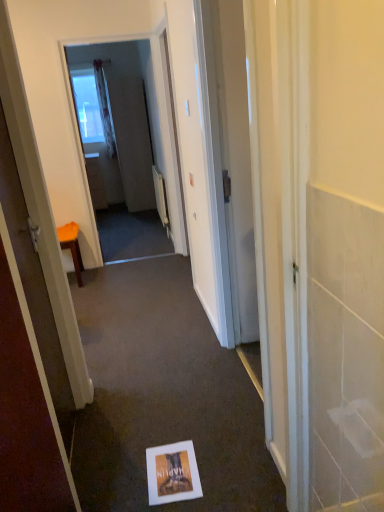
Question: From a real-world perspective, is orange fabric stool at left positioned under matte cardboard postcard at center based on gravity?

Choices:
 (A) yes
 (B) no

Answer: (B)

Question: Can you confirm if orange fabric stool at left is shorter than matte cardboard postcard at center?

Choices:
 (A) yes
 (B) no

Answer: (B)

Question: Is orange fabric stool at left bigger than matte cardboard postcard at center?

Choices:
 (A) yes
 (B) no

Answer: (A)

Question: Does orange fabric stool at left touch matte cardboard postcard at center?

Choices:
 (A) yes
 (B) no

Answer: (B)

Question: Is matte cardboard postcard at center at the back of orange fabric stool at left?

Choices:
 (A) yes
 (B) no

Answer: (B)

Question: Considering the relative sizes of orange fabric stool at left and matte cardboard postcard at center in the image provided, is orange fabric stool at left thinner than matte cardboard postcard at center?

Choices:
 (A) yes
 (B) no

Answer: (B)

Question: From the image's perspective, is orange fabric stool at left on matte gray screen door at center, acting as the second screen door starting from the front?

Choices:
 (A) yes
 (B) no

Answer: (B)

Question: Is orange fabric stool at left further to camera compared to matte gray screen door at center, acting as the second screen door starting from the front?

Choices:
 (A) no
 (B) yes

Answer: (A)

Question: Considering the relative sizes of orange fabric stool at left and matte gray screen door at center, which is the first screen door in back-to-front order, in the image provided, is orange fabric stool at left shorter than matte gray screen door at center, which is the first screen door in back-to-front order,?

Choices:
 (A) yes
 (B) no

Answer: (A)

Question: Would you consider orange fabric stool at left to be distant from matte gray screen door at center, acting as the second screen door starting from the front?

Choices:
 (A) no
 (B) yes

Answer: (B)

Question: Does orange fabric stool at left appear on the left side of matte gray screen door at center, acting as the second screen door starting from the front?

Choices:
 (A) no
 (B) yes

Answer: (B)

Question: Is orange fabric stool at left positioned with its back to matte gray screen door at center, acting as the second screen door starting from the front?

Choices:
 (A) no
 (B) yes

Answer: (A)

Question: Can you confirm if orange fabric stool at left is wider than matte white screen door at upper center, the second screen door from the back?

Choices:
 (A) no
 (B) yes

Answer: (B)